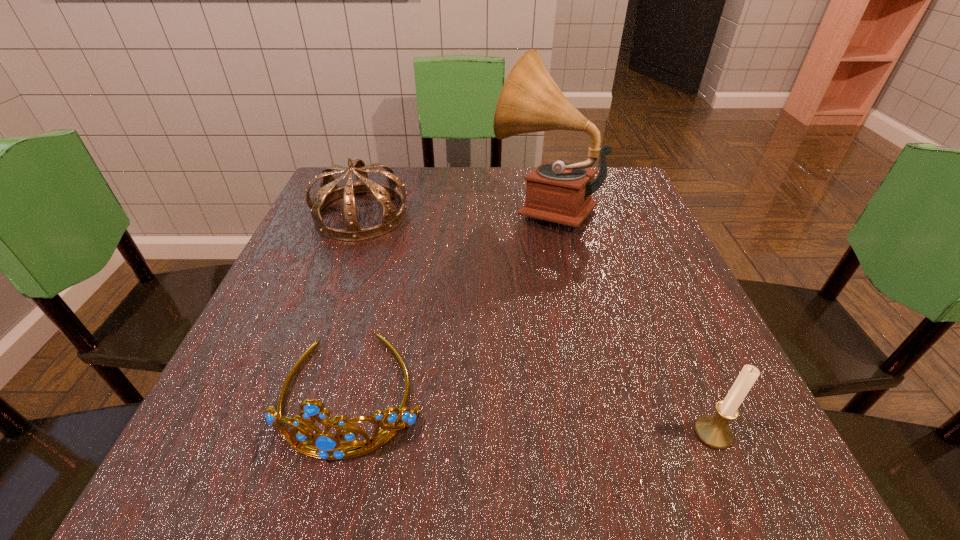
This screenshot has width=960, height=540. Find the location of `free space that satisfies the following two spatial constraints: 1. on the horn of the candle holder; 2. on the left side of the phonograph record`. free space that satisfies the following two spatial constraints: 1. on the horn of the candle holder; 2. on the left side of the phonograph record is located at coordinates (589, 433).

I want to click on free space that satisfies the following two spatial constraints: 1. on the horn of the tallest object; 2. on the front-facing side of the nearer tiara, so click(581, 393).

Locate an element on the screen. This screenshot has width=960, height=540. vacant region that satisfies the following two spatial constraints: 1. on the horn of the tallest object; 2. on the left side of the candle holder is located at coordinates [x=589, y=433].

Locate an element on the screen. blank space that satisfies the following two spatial constraints: 1. on the front-facing side of the nearer tiara; 2. on the right side of the candle holder is located at coordinates (341, 433).